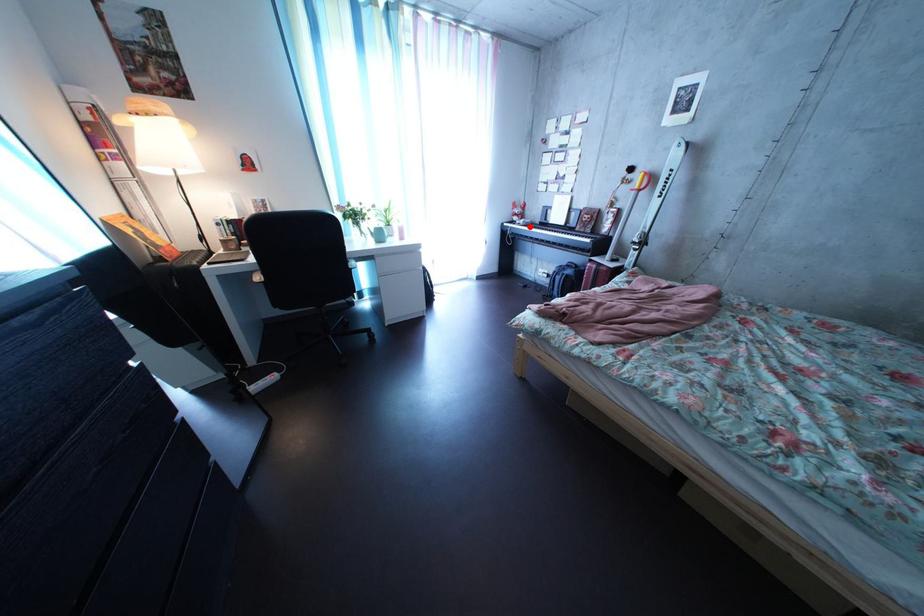
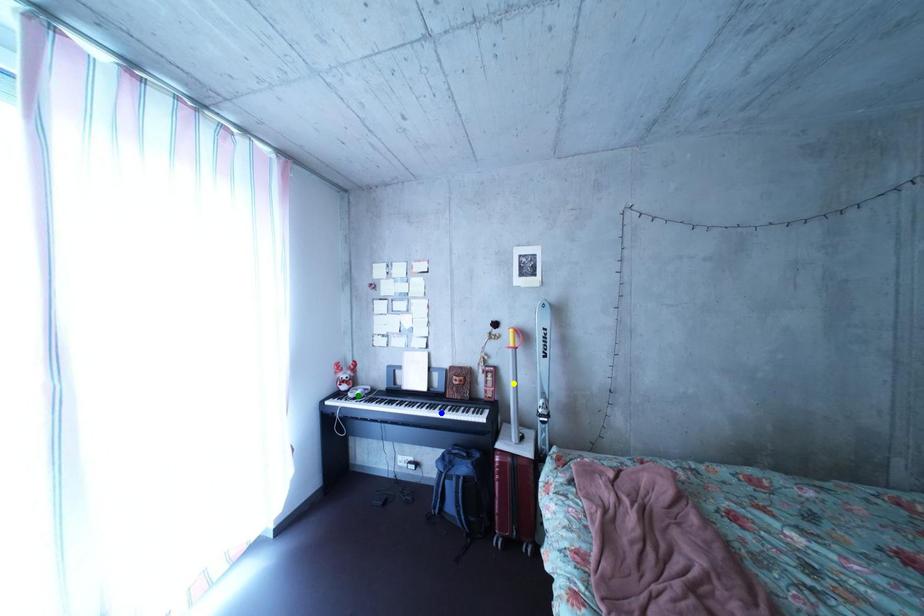
Question: I am providing you with two images of the same scene from different viewpoints. A red point is marked on the first image. You are given multiple points on the second image. Which spot in image 2 lines up with the point in image 1?

Choices:
 (A) blue point
 (B) green point
 (C) yellow point

Answer: (B)